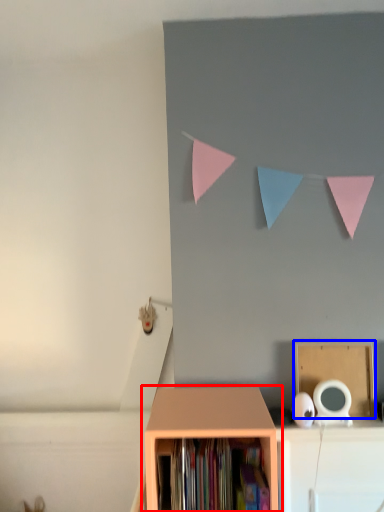
Question: Which object appears closest to the camera in this image, shelf (highlighted by a red box) or cardboard box (highlighted by a blue box)?

Choices:
 (A) shelf
 (B) cardboard box

Answer: (A)